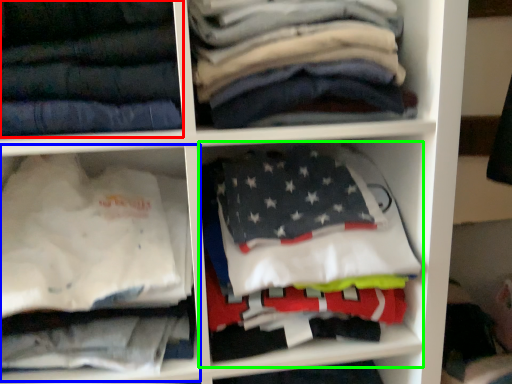
Question: Which object is positioned closest to trousers (highlighted by a red box)? Select from cabinet (highlighted by a blue box) and cabinet (highlighted by a green box).

Choices:
 (A) cabinet
 (B) cabinet

Answer: (A)